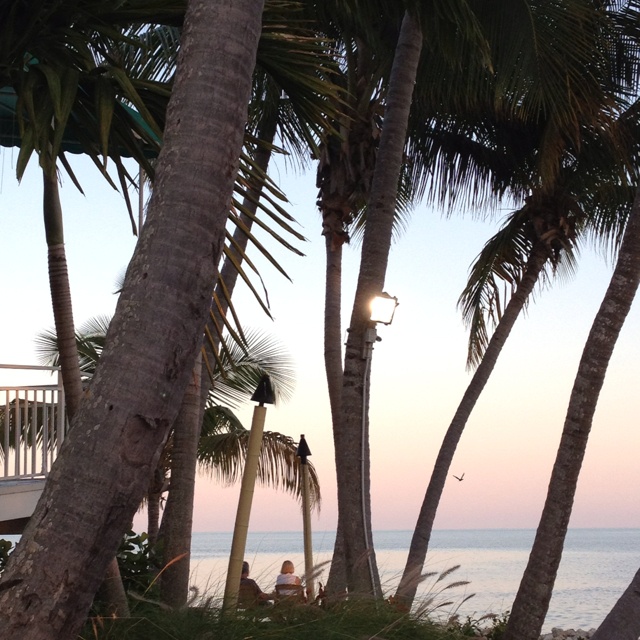
Identify the location of place to sit. The image size is (640, 640). (285, 596), (243, 598).